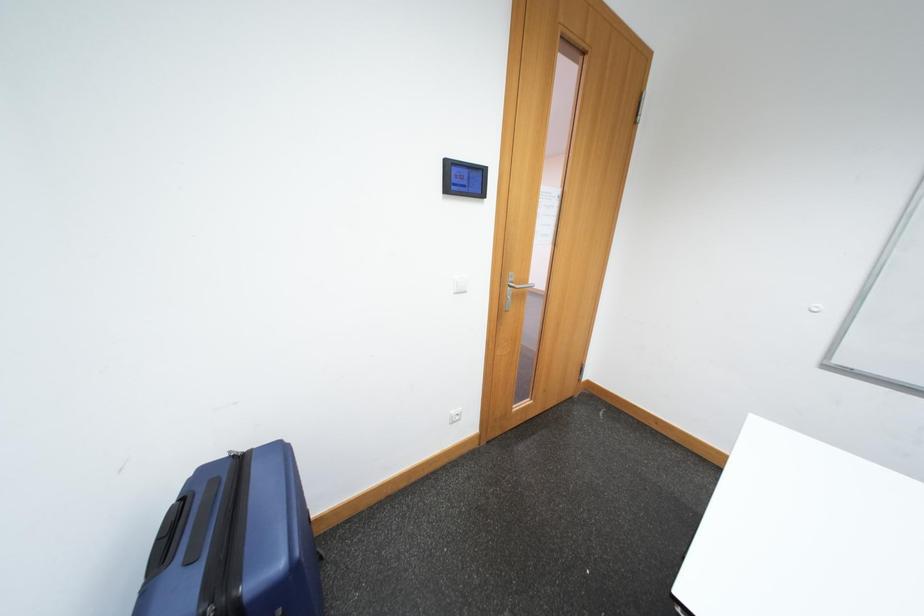
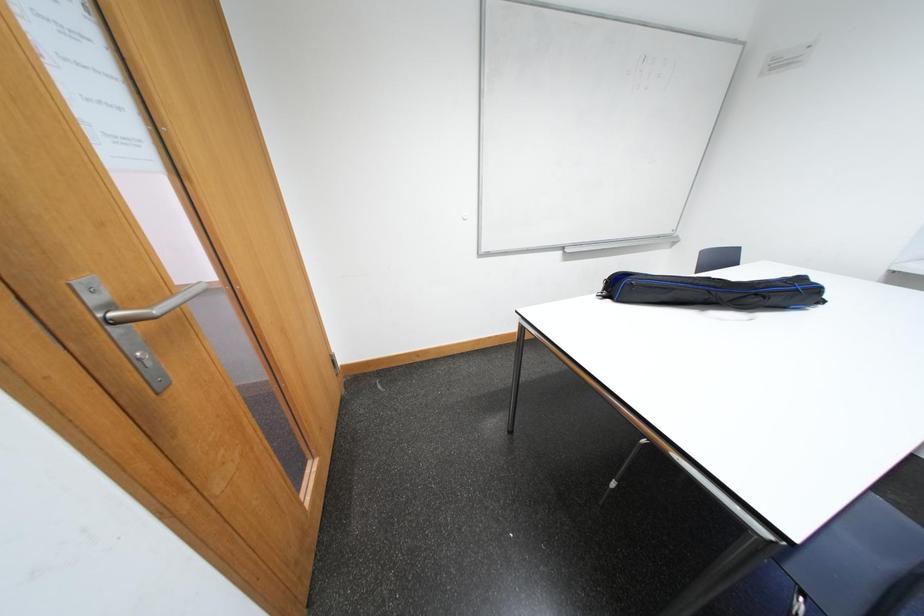
In the scene shown: The images are taken continuously from a first-person perspective. In which direction is your viewpoint rotating?

The rotation direction of the camera is right-down.